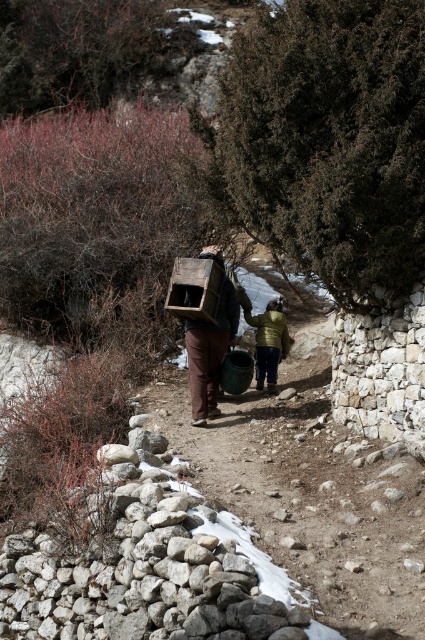
Question: Which object appears closest to the camera in this image?

Choices:
 (A) brown matte wooden crate at center
 (B) wooden crate at center
 (C) yellow-green fabric jacket at center

Answer: (B)

Question: Is brown matte wooden crate at center positioned behind yellow-green fabric jacket at center?

Choices:
 (A) yes
 (B) no

Answer: (B)

Question: Is brown matte wooden crate at center positioned before yellow-green fabric jacket at center?

Choices:
 (A) yes
 (B) no

Answer: (A)

Question: Which object is positioned farthest from the yellow-green fabric jacket at center?

Choices:
 (A) brown matte wooden crate at center
 (B) wooden crate at center

Answer: (B)

Question: Can you confirm if brown matte wooden crate at center is positioned below wooden crate at center?

Choices:
 (A) yes
 (B) no

Answer: (A)

Question: Which point is closer to the camera taking this photo?

Choices:
 (A) (220, 284)
 (B) (221, 292)
 (C) (261, 374)

Answer: (A)